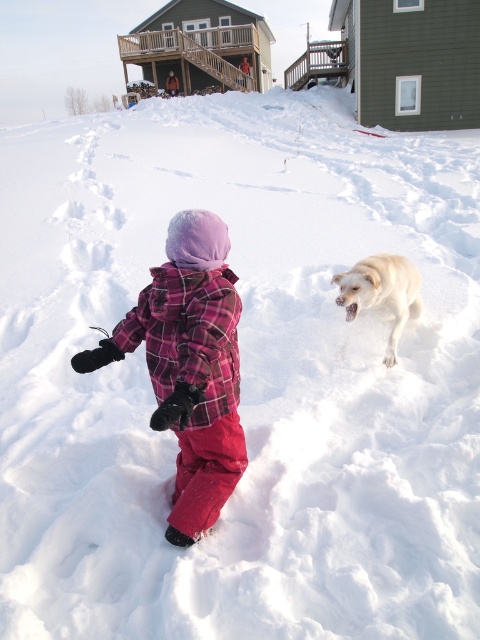
Question: Can you confirm if plaid fleece snowsuit at center is thinner than light yellow fur at center?

Choices:
 (A) yes
 (B) no

Answer: (A)

Question: Which object is closer to the camera taking this photo?

Choices:
 (A) light yellow fur at center
 (B) plaid fleece snowsuit at center

Answer: (B)

Question: Is plaid fleece snowsuit at center wider than light yellow fur at center?

Choices:
 (A) no
 (B) yes

Answer: (A)

Question: Is plaid fleece snowsuit at center smaller than light yellow fur at center?

Choices:
 (A) yes
 (B) no

Answer: (B)